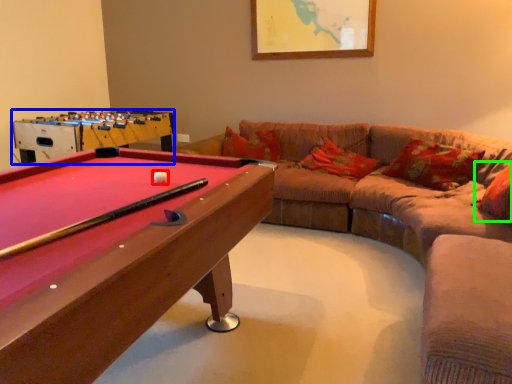
Question: Which object is positioned closest to ball (highlighted by a red box)? Select from table (highlighted by a blue box) and pillow (highlighted by a green box).

Choices:
 (A) table
 (B) pillow

Answer: (B)